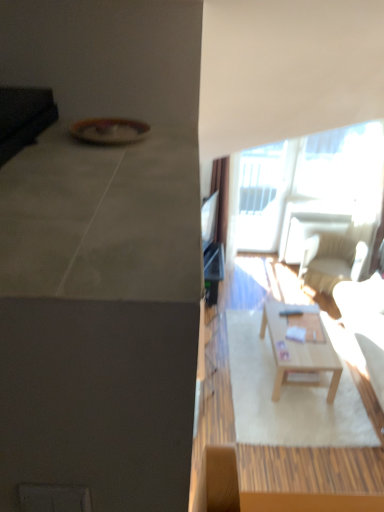
Question: Is light brown wooden coffee table at center next to matte black tv at upper right and touching it?

Choices:
 (A) yes
 (B) no

Answer: (B)

Question: Can you confirm if light brown wooden coffee table at center is taller than matte black tv at upper right?

Choices:
 (A) no
 (B) yes

Answer: (A)

Question: Is light brown wooden coffee table at center to the left of matte black tv at upper right from the viewer's perspective?

Choices:
 (A) yes
 (B) no

Answer: (B)

Question: Does light brown wooden coffee table at center have a smaller size compared to matte black tv at upper right?

Choices:
 (A) no
 (B) yes

Answer: (A)

Question: From a real-world perspective, is light brown wooden coffee table at center positioned over matte black tv at upper right based on gravity?

Choices:
 (A) yes
 (B) no

Answer: (B)

Question: Is white leather couch at right in front of or behind transparent glass window at upper right in the image?

Choices:
 (A) front
 (B) behind

Answer: (A)

Question: In the image, is white leather couch at right on the left side or the right side of transparent glass window at upper right?

Choices:
 (A) left
 (B) right

Answer: (B)

Question: From the image's perspective, is white leather couch at right located above or below transparent glass window at upper right?

Choices:
 (A) above
 (B) below

Answer: (B)

Question: From their relative heights in the image, would you say white leather couch at right is taller or shorter than transparent glass window at upper right?

Choices:
 (A) tall
 (B) short

Answer: (B)

Question: Would you say transparent glass window at upper right is to the left or to the right of matte black tv at upper right in the picture?

Choices:
 (A) left
 (B) right

Answer: (B)

Question: From a real-world perspective, is transparent glass window at upper right above or below matte black tv at upper right?

Choices:
 (A) above
 (B) below

Answer: (B)

Question: In terms of height, does transparent glass window at upper right look taller or shorter compared to matte black tv at upper right?

Choices:
 (A) short
 (B) tall

Answer: (B)

Question: Considering their positions, is transparent glass window at upper right located in front of or behind matte black tv at upper right?

Choices:
 (A) front
 (B) behind

Answer: (B)

Question: From the image's perspective, is matte black tv at upper right positioned above or below white leather couch at right?

Choices:
 (A) above
 (B) below

Answer: (A)

Question: Looking at the image, does matte black tv at upper right seem bigger or smaller compared to white leather couch at right?

Choices:
 (A) big
 (B) small

Answer: (B)